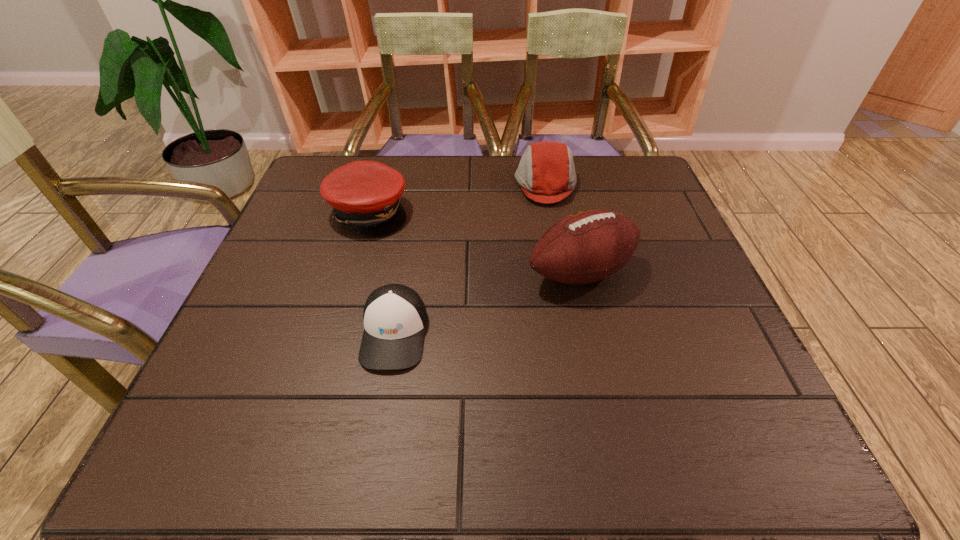
At what (x,y) coordinates should I click in order to perform the action: click on unoccupied position between the tallest object and the nearest cap. Please return your answer as a coordinate pair (x, y). Looking at the image, I should click on (488, 303).

Locate an element on the screen. The image size is (960, 540). object that ranks as the third closest to the rightmost cap is located at coordinates pyautogui.click(x=395, y=317).

Select which object appears as the closest to the nearest cap. Please provide its 2D coordinates. Your answer should be formatted as a tuple, i.e. [(x, y)], where the tuple contains the x and y coordinates of a point satisfying the conditions above.

[(365, 195)]

Locate which cap ranks in proximity to the rightmost cap. Please provide its 2D coordinates. Your answer should be formatted as a tuple, i.e. [(x, y)], where the tuple contains the x and y coordinates of a point satisfying the conditions above.

[(365, 195)]

Where is `cap that is the second closest to the nearest cap`? cap that is the second closest to the nearest cap is located at coordinates tap(546, 173).

Find the location of a particular element. blank area in the image that satisfies the following two spatial constraints: 1. on the front-facing side of the rightmost cap; 2. on the front panel of the nearest cap is located at coordinates (573, 333).

Where is `free point that satisfies the following two spatial constraints: 1. on the front-facing side of the rightmost cap; 2. on the left side of the football (American)`? free point that satisfies the following two spatial constraints: 1. on the front-facing side of the rightmost cap; 2. on the left side of the football (American) is located at coordinates (563, 273).

You are a GUI agent. You are given a task and a screenshot of the screen. Output one action in this format:
    pyautogui.click(x=<x>, y=<y>)
    Task: Click on the free space that satisfies the following two spatial constraints: 1. on the front-facing side of the football (American); 2. on the left side of the rightmost cap
    This screenshot has width=960, height=540.
    Given the screenshot: What is the action you would take?
    pyautogui.click(x=563, y=273)